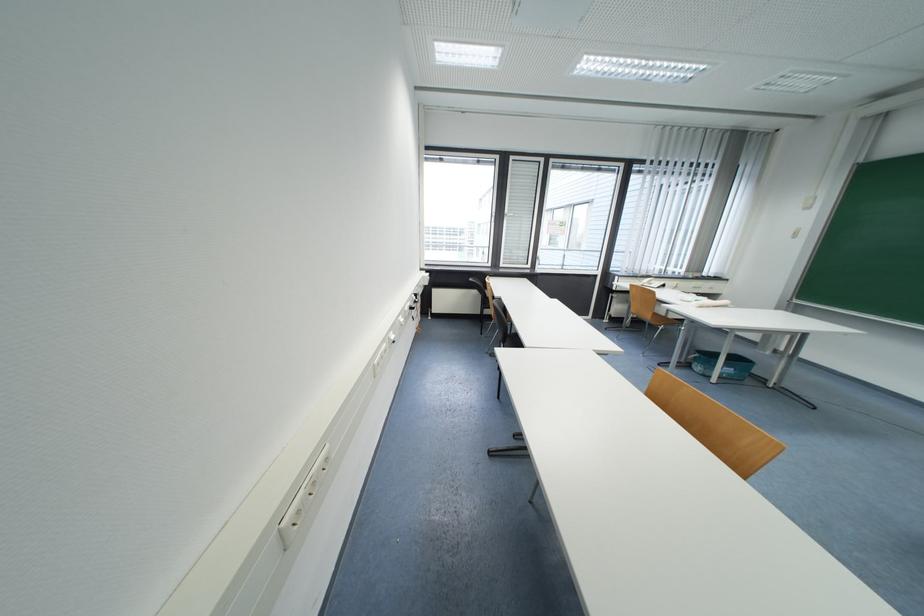
Where would you lift the telephone handset? Please return your answer as a coordinate pair (x, y).

(652, 282)